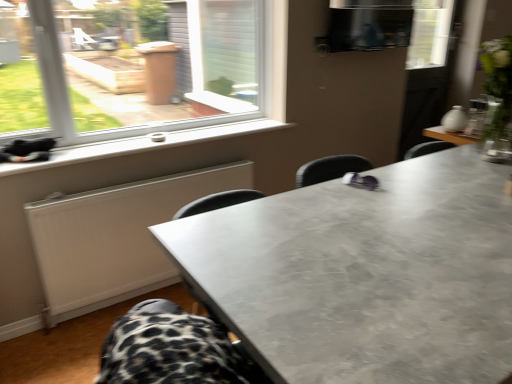
Question: Does matte gray table at center have a lesser height compared to white plastic window sill at lower left?

Choices:
 (A) yes
 (B) no

Answer: (B)

Question: Are matte gray table at center and white plastic window sill at lower left making contact?

Choices:
 (A) yes
 (B) no

Answer: (B)

Question: From a real-world perspective, is matte gray table at center on white plastic window sill at lower left?

Choices:
 (A) no
 (B) yes

Answer: (A)

Question: Is matte gray table at center smaller than white plastic window sill at lower left?

Choices:
 (A) yes
 (B) no

Answer: (B)

Question: From the image's perspective, is matte gray table at center located beneath white plastic window sill at lower left?

Choices:
 (A) yes
 (B) no

Answer: (A)

Question: From a real-world perspective, is white matte radiator at lower left physically located above or below matte gray table at center?

Choices:
 (A) below
 (B) above

Answer: (A)

Question: In terms of width, does white matte radiator at lower left look wider or thinner when compared to matte gray table at center?

Choices:
 (A) thin
 (B) wide

Answer: (A)

Question: Considering their positions, is white matte radiator at lower left located in front of or behind matte gray table at center?

Choices:
 (A) behind
 (B) front

Answer: (A)

Question: Considering the positions of white matte radiator at lower left and matte gray table at center in the image, is white matte radiator at lower left taller or shorter than matte gray table at center?

Choices:
 (A) short
 (B) tall

Answer: (A)

Question: From the image's perspective, is matte gray table at center located above or below white matte radiator at lower left?

Choices:
 (A) below
 (B) above

Answer: (A)

Question: Considering the positions of matte gray table at center and white matte radiator at lower left in the image, is matte gray table at center taller or shorter than white matte radiator at lower left?

Choices:
 (A) short
 (B) tall

Answer: (B)

Question: Considering the positions of matte gray table at center and white matte radiator at lower left in the image, is matte gray table at center bigger or smaller than white matte radiator at lower left?

Choices:
 (A) small
 (B) big

Answer: (B)

Question: Which is correct: matte gray table at center is inside white matte radiator at lower left, or outside of it?

Choices:
 (A) inside
 (B) outside

Answer: (B)

Question: Visually, is white matte radiator at lower left positioned to the left or to the right of white plastic window sill at lower left?

Choices:
 (A) right
 (B) left

Answer: (B)

Question: In terms of height, does white matte radiator at lower left look taller or shorter compared to white plastic window sill at lower left?

Choices:
 (A) short
 (B) tall

Answer: (B)